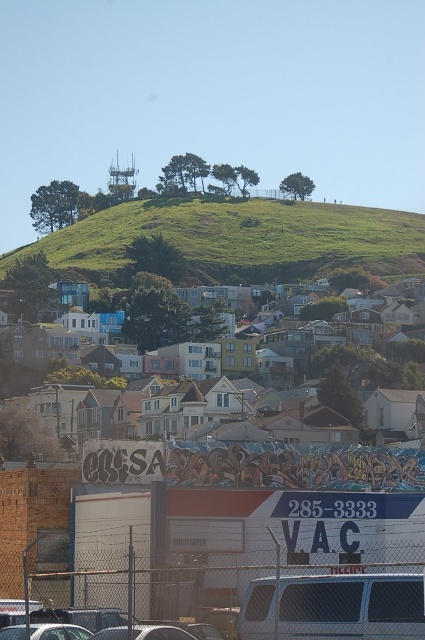
Who is higher up, green grassy hillside at center or metallic silver car at lower center?

green grassy hillside at center is above.

Can you confirm if green grassy hillside at center is positioned above metallic silver car at lower center?

Correct, green grassy hillside at center is located above metallic silver car at lower center.

Between point (334, 253) and point (48, 616), which one is positioned in front?

Positioned in front is point (48, 616).

In order to click on green grassy hillside at center in this screenshot , I will do `click(240, 240)`.

Looking at this image, does metallic silver van at lower center have a lesser height compared to metallic silver car at lower center?

No, metallic silver van at lower center is not shorter than metallic silver car at lower center.

Which is above, metallic silver van at lower center or metallic silver car at lower center?

Positioned higher is metallic silver van at lower center.

Measure the distance between metallic silver van at lower center and camera.

metallic silver van at lower center is 51.98 meters from camera.

Where is `metallic silver van at lower center`? The height and width of the screenshot is (640, 425). metallic silver van at lower center is located at coordinates (351, 605).

Does metal chain-link fence at lower center appear on the left side of metallic silver van at lower center?

Correct, you'll find metal chain-link fence at lower center to the left of metallic silver van at lower center.

At what (x,y) coordinates should I click in order to perform the action: click on metal chain-link fence at lower center. Please return your answer as a coordinate pair (x, y). This screenshot has height=640, width=425. Looking at the image, I should click on (357, 580).

Is point (198, 598) positioned after point (311, 602)?

That is True.

Identify the location of metal chain-link fence at lower center. (357, 580).